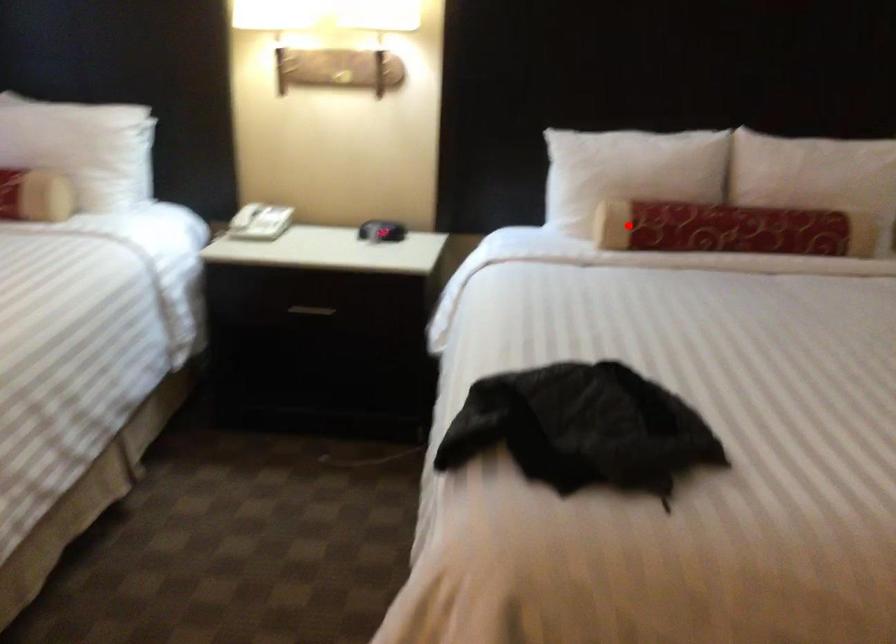
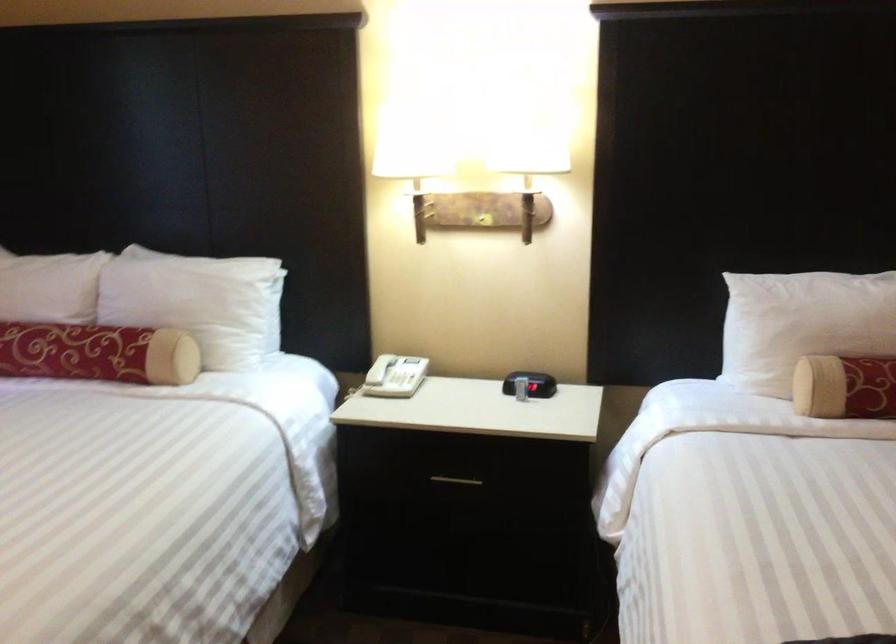
The point at the highlighted location is marked in the first image. Where is the corresponding point in the second image?

(845, 386)